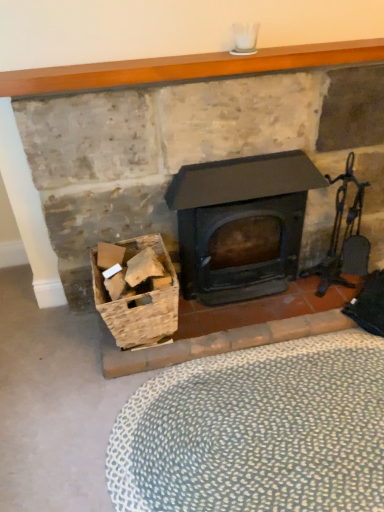
Question: Is matte black wood burning stove at center aimed at smooth wooden mantle at upper center?

Choices:
 (A) no
 (B) yes

Answer: (A)

Question: Considering the relative sizes of matte black wood burning stove at center and smooth wooden mantle at upper center in the image provided, is matte black wood burning stove at center wider than smooth wooden mantle at upper center?

Choices:
 (A) no
 (B) yes

Answer: (B)

Question: Does matte black wood burning stove at center have a greater height compared to smooth wooden mantle at upper center?

Choices:
 (A) yes
 (B) no

Answer: (A)

Question: Are matte black wood burning stove at center and smooth wooden mantle at upper center far apart?

Choices:
 (A) yes
 (B) no

Answer: (B)

Question: Is matte black wood burning stove at center positioned before smooth wooden mantle at upper center?

Choices:
 (A) no
 (B) yes

Answer: (A)

Question: Based on their positions, is wooden crate at lower left located to the left or right of metallic dark brown fireplace tool set at right?

Choices:
 (A) left
 (B) right

Answer: (A)

Question: Is wooden crate at lower left taller or shorter than metallic dark brown fireplace tool set at right?

Choices:
 (A) short
 (B) tall

Answer: (A)

Question: Is point (173, 283) positioned closer to the camera than point (331, 249)?

Choices:
 (A) farther
 (B) closer

Answer: (B)

Question: From the image's perspective, is wooden crate at lower left positioned above or below metallic dark brown fireplace tool set at right?

Choices:
 (A) below
 (B) above

Answer: (A)

Question: Relative to wooden crate at lower left, is matte black stove at center in front or behind?

Choices:
 (A) behind
 (B) front

Answer: (B)

Question: Is point (137, 81) closer or farther from the camera than point (112, 330)?

Choices:
 (A) farther
 (B) closer

Answer: (B)

Question: Looking at their shapes, would you say matte black stove at center is wider or thinner than wooden crate at lower left?

Choices:
 (A) wide
 (B) thin

Answer: (B)

Question: From their relative heights in the image, would you say matte black stove at center is taller or shorter than wooden crate at lower left?

Choices:
 (A) short
 (B) tall

Answer: (B)

Question: Is white dotted rug at lower center bigger or smaller than matte black wood burning stove at center?

Choices:
 (A) small
 (B) big

Answer: (A)

Question: From a real-world perspective, is white dotted rug at lower center physically located above or below matte black wood burning stove at center?

Choices:
 (A) above
 (B) below

Answer: (B)